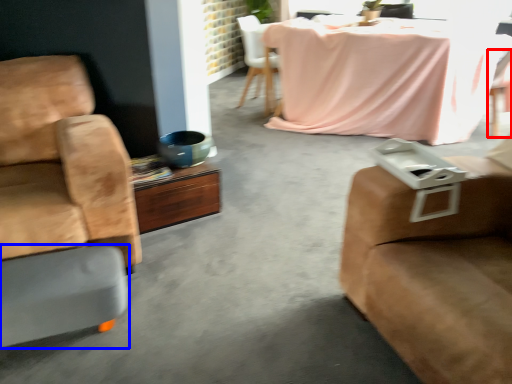
Question: Which point is closer to the camera, chair (highlighted by a red box) or footrest (highlighted by a blue box)?

Choices:
 (A) chair
 (B) footrest

Answer: (B)